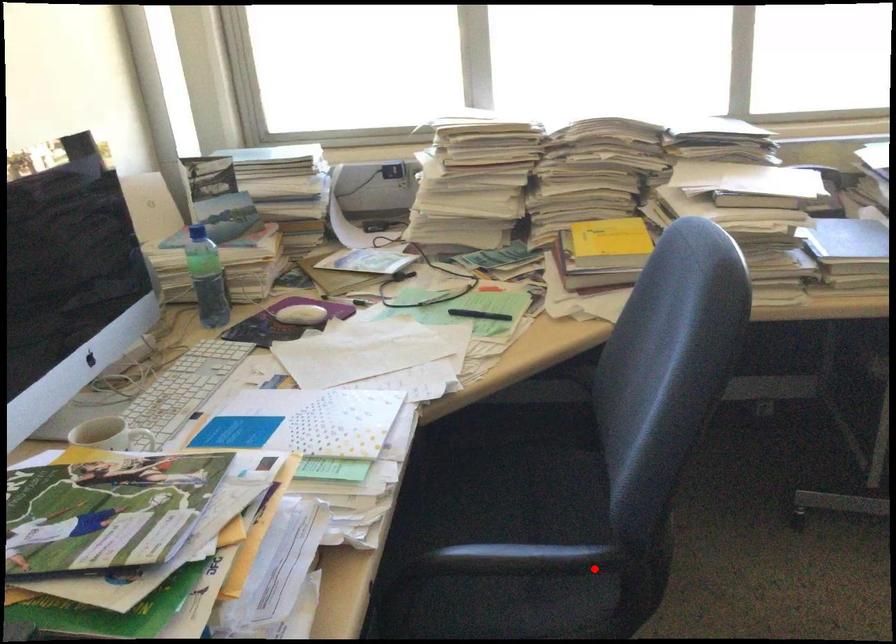
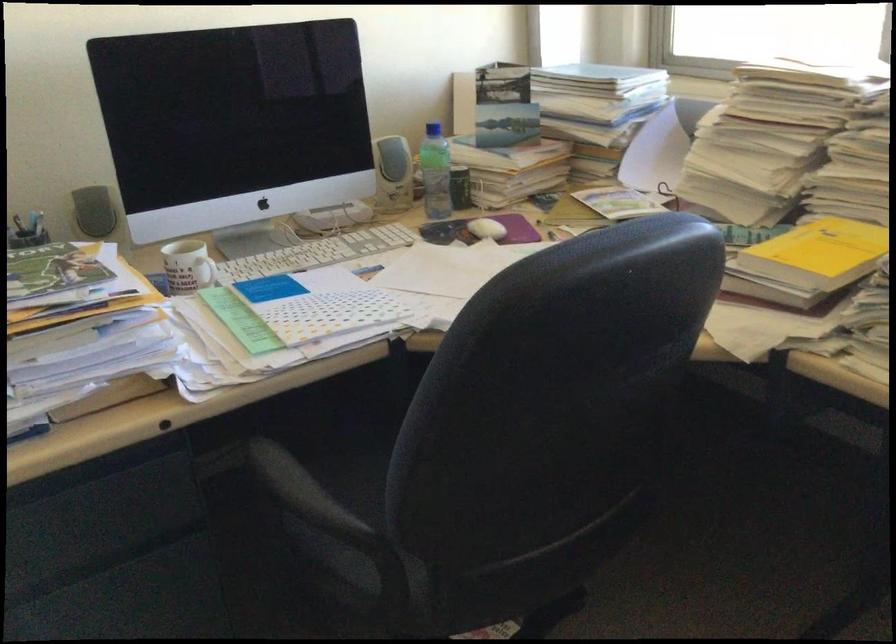
Find the pixel in the second image that matches the highlighted location in the first image.

(314, 521)